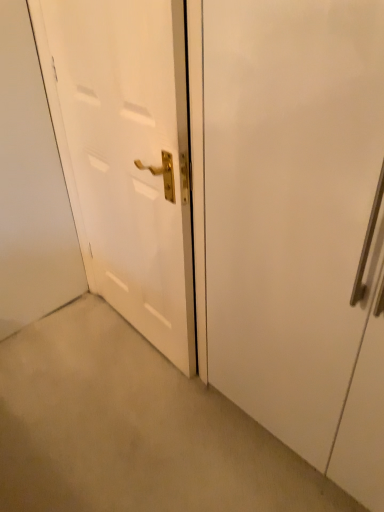
Question: In the image, is white matte door at right, acting as the 2th door starting from the left, on the left side or the right side of white glossy door at center, the second door in the right-to-left sequence?

Choices:
 (A) right
 (B) left

Answer: (A)

Question: Based on their sizes in the image, would you say white matte door at right, acting as the first door starting from the right, is bigger or smaller than white glossy door at center, the second door in the right-to-left sequence?

Choices:
 (A) big
 (B) small

Answer: (A)

Question: Considering the positions of white matte door at right, acting as the 2th door starting from the left, and white glossy door at center, arranged as the first door when viewed from the left, in the image, is white matte door at right, acting as the 2th door starting from the left, wider or thinner than white glossy door at center, arranged as the first door when viewed from the left,?

Choices:
 (A) thin
 (B) wide

Answer: (B)

Question: From the image's perspective, is white glossy door at center, arranged as the first door when viewed from the left, located above or below white matte door at right, acting as the first door starting from the right?

Choices:
 (A) below
 (B) above

Answer: (B)

Question: Is white glossy door at center, arranged as the first door when viewed from the left, inside the boundaries of white matte door at right, acting as the first door starting from the right, or outside?

Choices:
 (A) outside
 (B) inside

Answer: (A)

Question: Visually, is white glossy door at center, the second door in the right-to-left sequence, positioned to the left or to the right of white matte door at right, acting as the 2th door starting from the left?

Choices:
 (A) left
 (B) right

Answer: (A)

Question: Is white glossy door at center, the second door in the right-to-left sequence, in front of or behind white matte door at right, acting as the first door starting from the right, in the image?

Choices:
 (A) front
 (B) behind

Answer: (B)